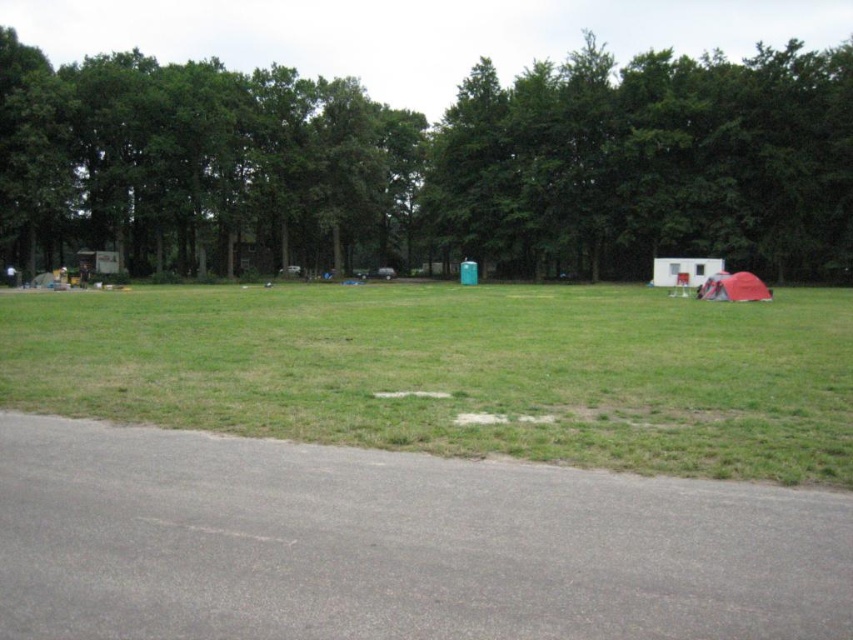
Does green grass at center come in front of red fabric tent at lower right?

Yes, it is in front of red fabric tent at lower right.

Which is more to the left, green grass at center or red fabric tent at lower right?

From the viewer's perspective, green grass at center appears more on the left side.

Is point (648, 314) behind point (730, 276)?

No.

Where is `green grass at center`? The image size is (853, 640). green grass at center is located at coordinates (459, 371).

Which is in front, point (184, 172) or point (793, 477)?

Point (793, 477)

Is point (354, 116) closer to viewer compared to point (642, 408)?

No, (354, 116) is further to viewer.

Does point (115, 230) lie in front of point (614, 392)?

No, (115, 230) is further to viewer.

Where is `green leafy tree at upper center`? The height and width of the screenshot is (640, 853). green leafy tree at upper center is located at coordinates (431, 164).

From the picture: Can you confirm if green leafy tree at upper center is taller than red fabric tent at lower right?

Indeed, green leafy tree at upper center has a greater height compared to red fabric tent at lower right.

At what (x,y) coordinates should I click in order to perform the action: click on green leafy tree at upper center. Please return your answer as a coordinate pair (x, y). The image size is (853, 640). Looking at the image, I should click on (431, 164).

Which is in front, point (355, 88) or point (733, 298)?

Positioned in front is point (733, 298).

What are the coordinates of `green leafy tree at upper center` in the screenshot? It's located at (431, 164).